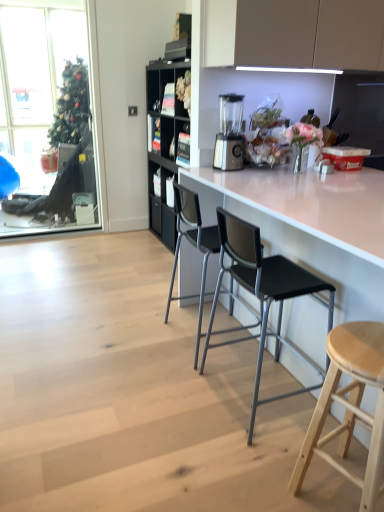
This screenshot has height=512, width=384. Identify the location of free location in front of black plastic chair at center, acting as the 1th chair starting from the front. (x=233, y=460).